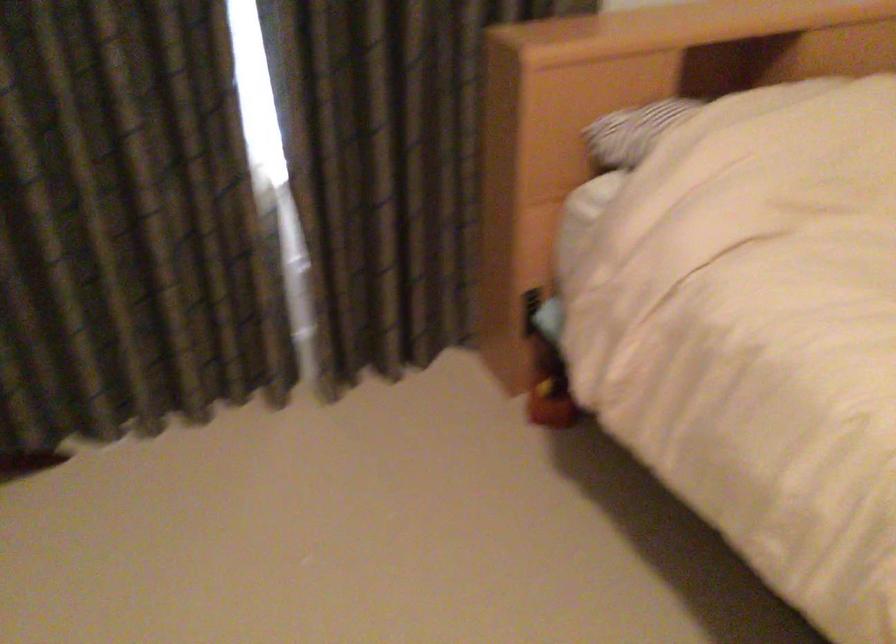
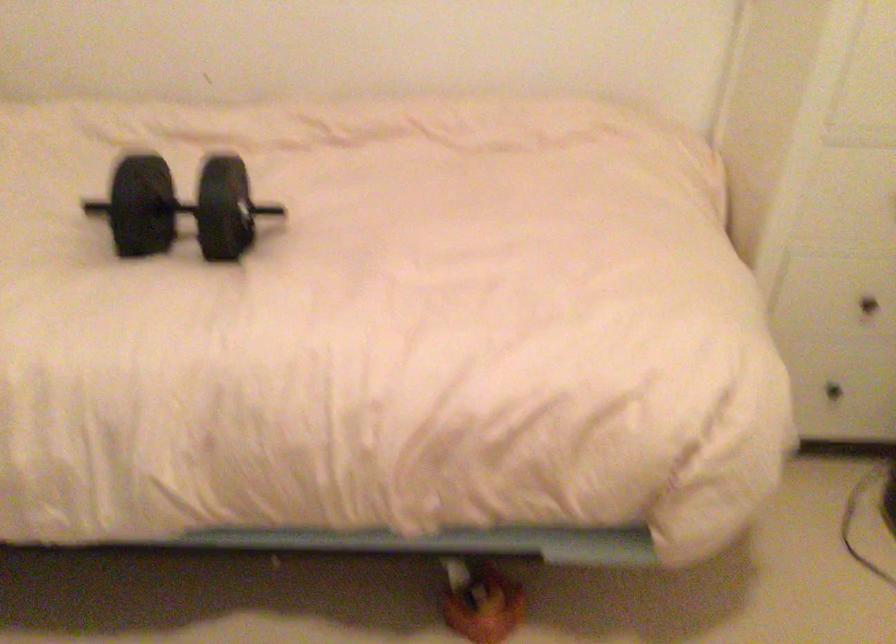
Question: The images are taken continuously from a first-person perspective. In which direction is your viewpoint rotating?

Choices:
 (A) Left
 (B) Right
 (C) Up
 (D) Down

Answer: (B)